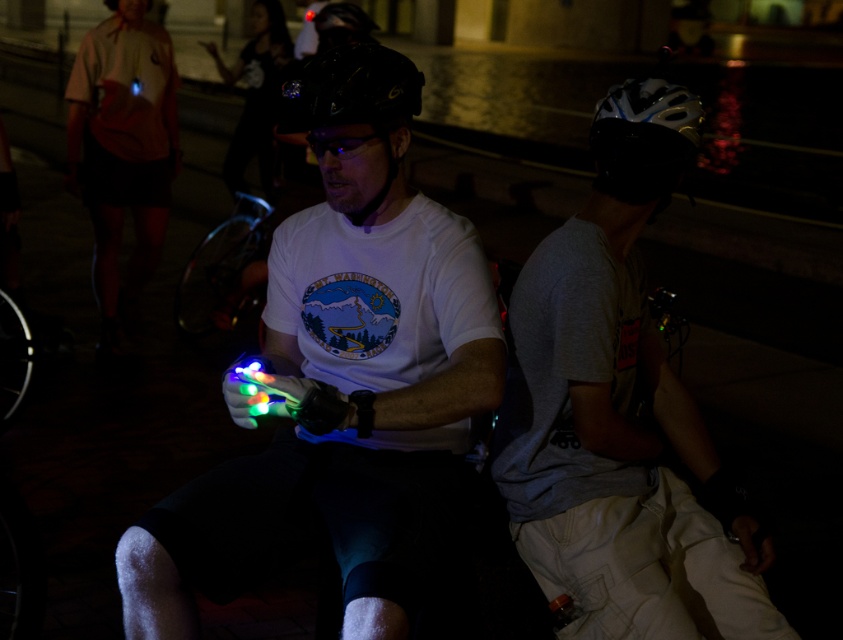
Question: Which point is farther to the camera?

Choices:
 (A) (165, 497)
 (B) (379, 83)
 (C) (121, 52)
 (D) (610, 570)

Answer: (C)

Question: Can you confirm if white matte bicycle helmet at upper right is positioned below black matte helmet at center?

Choices:
 (A) yes
 (B) no

Answer: (B)

Question: Among these objects, which one is farthest from the camera?

Choices:
 (A) black matte helmet at center
 (B) gray fabric shirt at right
 (C) white matte t-shirt at center

Answer: (B)

Question: Is the position of gray fabric shirt at right more distant than that of matte orange shirt at upper left?

Choices:
 (A) no
 (B) yes

Answer: (A)

Question: Which of the following is the farthest from the observer?

Choices:
 (A) gray fabric shirt at right
 (B) white matte bicycle helmet at upper right
 (C) white matte t-shirt at center
 (D) matte orange shirt at upper left

Answer: (D)

Question: Can you confirm if gray fabric shirt at right is wider than black matte helmet at center?

Choices:
 (A) yes
 (B) no

Answer: (A)